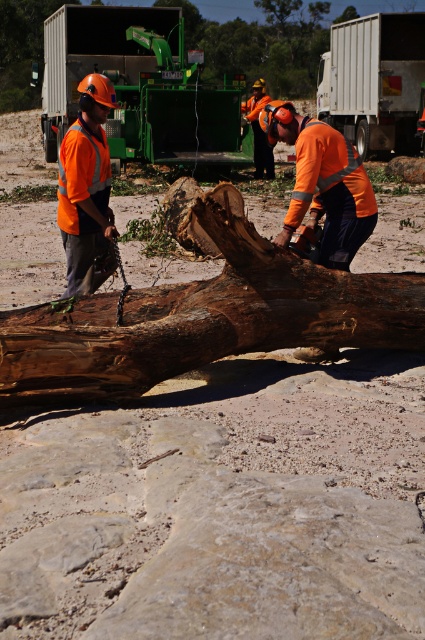
You are a safety inspector at the logging site. You need to ensure that the brown rough wood at center and the green metallic trailer truck at upper center are positioned safely. According to the scene description, which object is located to the right of the other?

The brown rough wood at center is to the right of the green metallic trailer truck at upper center.

You are a safety inspector at the logging site. You need to ensure that the two trailer trucks are parked at least 20 feet apart for safety regulations. Are the green metallic trailer truck at upper center and the white matte trailer truck at upper center compliant with the safety distance requirement?

The green metallic trailer truck at upper center and the white matte trailer truck at upper center are 20.19 feet apart from each other, which exceeds the minimum required distance of 20 feet. Therefore, they are compliant with the safety distance requirement.